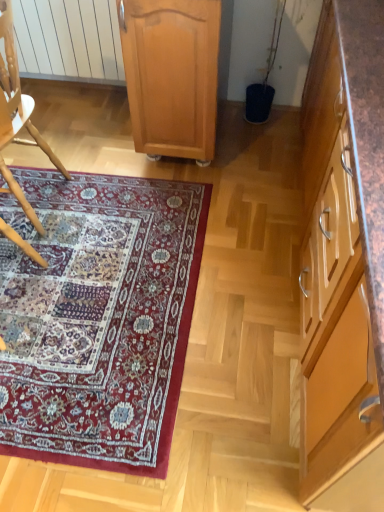
Locate an element on the screen. This screenshot has height=512, width=384. free space between light brown wood cabinet at center, arranged as the 2th cabinetry when viewed from the right, and carpet with intricate patterns at lower left is located at coordinates tap(107, 156).